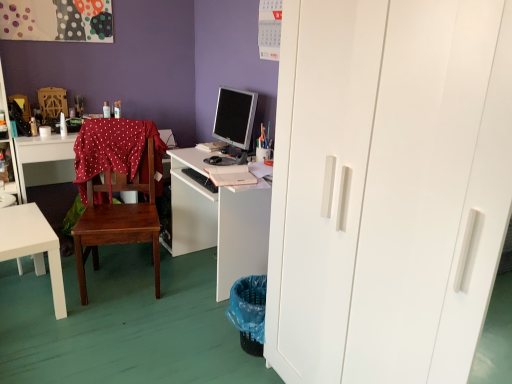
Where is `free spot below wooden chair at center (from a real-world perspective)`? free spot below wooden chair at center (from a real-world perspective) is located at coordinates (128, 278).